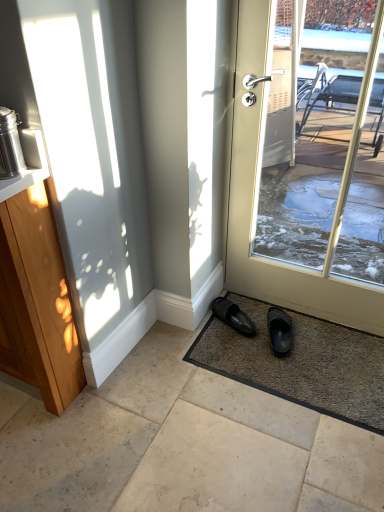
Find the location of a particular element. This screenshot has width=384, height=512. vacant space in front of black rubber slipper at lower center, the 2th footwear when ordered from right to left is located at coordinates (230, 352).